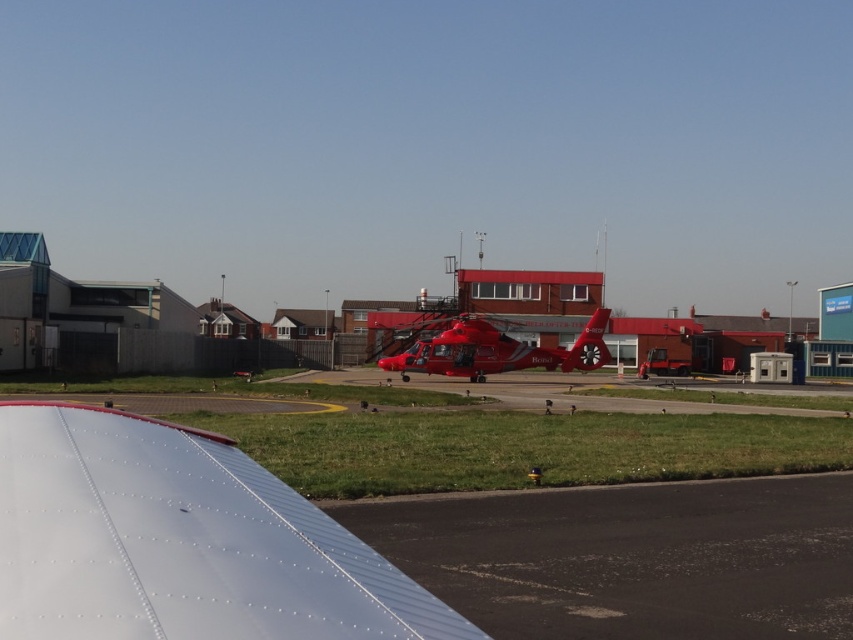
Question: Is black asphalt runway at lower center positioned at the back of metallic red helicopter at center?

Choices:
 (A) no
 (B) yes

Answer: (A)

Question: Observing the image, what is the correct spatial positioning of black asphalt runway at lower center in reference to metallic red helicopter at center?

Choices:
 (A) left
 (B) right

Answer: (B)

Question: Which object appears closest to the camera in this image?

Choices:
 (A) white metallic wing at lower left
 (B) metallic red helicopter at center
 (C) black asphalt runway at lower center

Answer: (A)

Question: Is white metallic wing at lower left to the left of black asphalt runway at lower center from the viewer's perspective?

Choices:
 (A) yes
 (B) no

Answer: (A)

Question: Based on their relative distances, which object is nearer to the white metallic wing at lower left?

Choices:
 (A) black asphalt runway at lower center
 (B) metallic red helicopter at center

Answer: (A)

Question: Considering the real-world distances, which object is closest to the black asphalt runway at lower center?

Choices:
 (A) white metallic wing at lower left
 (B) metallic red helicopter at center

Answer: (A)